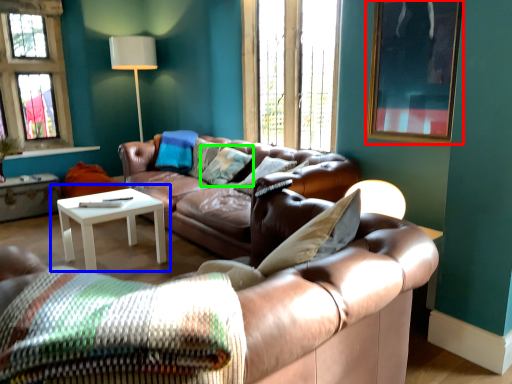
Question: Which is nearer to the picture frame (highlighted by a red box)? coffee table (highlighted by a blue box) or pillow (highlighted by a green box).

Choices:
 (A) coffee table
 (B) pillow

Answer: (B)